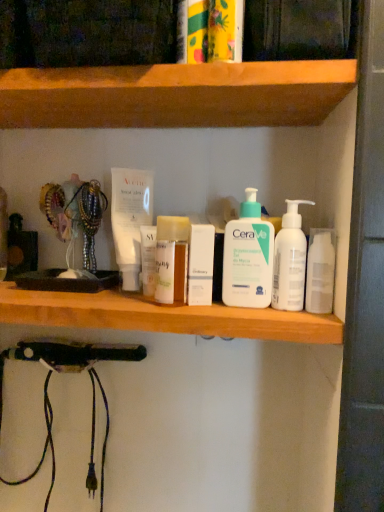
Question: In which direction should I rotate to look at white matte pump bottle at center, which is the second cleaning product from right to left?

Choices:
 (A) right
 (B) left

Answer: (A)

Question: Is white plastic bottles at center, arranged as the second shelf when viewed from the top, behind white matte box at center?

Choices:
 (A) no
 (B) yes

Answer: (A)

Question: Is white plastic bottles at center, marked as the 1th shelf in a bottom-to-top arrangement, facing away from white matte box at center?

Choices:
 (A) no
 (B) yes

Answer: (A)

Question: Is white plastic bottles at center, marked as the 1th shelf in a bottom-to-top arrangement, to the right of white matte box at center from the viewer's perspective?

Choices:
 (A) yes
 (B) no

Answer: (B)

Question: Is white plastic bottles at center, marked as the 1th shelf in a bottom-to-top arrangement, oriented towards white matte box at center?

Choices:
 (A) no
 (B) yes

Answer: (A)

Question: From a real-world perspective, is white plastic bottles at center, marked as the 1th shelf in a bottom-to-top arrangement, positioned over white matte box at center based on gravity?

Choices:
 (A) yes
 (B) no

Answer: (B)

Question: Does white matte box at center have a larger size compared to white plastic bottles at center, marked as the 1th shelf in a bottom-to-top arrangement?

Choices:
 (A) no
 (B) yes

Answer: (A)

Question: Considering the relative sizes of white matte box at center and white plastic bottles at center, marked as the 1th shelf in a bottom-to-top arrangement, in the image provided, is white matte box at center taller than white plastic bottles at center, marked as the 1th shelf in a bottom-to-top arrangement,?

Choices:
 (A) no
 (B) yes

Answer: (B)

Question: Is white matte box at center facing away from white plastic bottles at center, arranged as the second shelf when viewed from the top?

Choices:
 (A) no
 (B) yes

Answer: (A)

Question: Would you say white matte box at center is outside white plastic bottles at center, marked as the 1th shelf in a bottom-to-top arrangement?

Choices:
 (A) no
 (B) yes

Answer: (B)

Question: Can you confirm if white matte box at center is wider than white plastic bottles at center, marked as the 1th shelf in a bottom-to-top arrangement?

Choices:
 (A) no
 (B) yes

Answer: (A)

Question: Considering the relative sizes of white matte box at center and white plastic bottles at center, marked as the 1th shelf in a bottom-to-top arrangement, in the image provided, is white matte box at center shorter than white plastic bottles at center, marked as the 1th shelf in a bottom-to-top arrangement,?

Choices:
 (A) yes
 (B) no

Answer: (B)

Question: Does white glossy mouthwash at right come in front of white matte pump bottle at center, which is the second cleaning product from right to left?

Choices:
 (A) no
 (B) yes

Answer: (B)